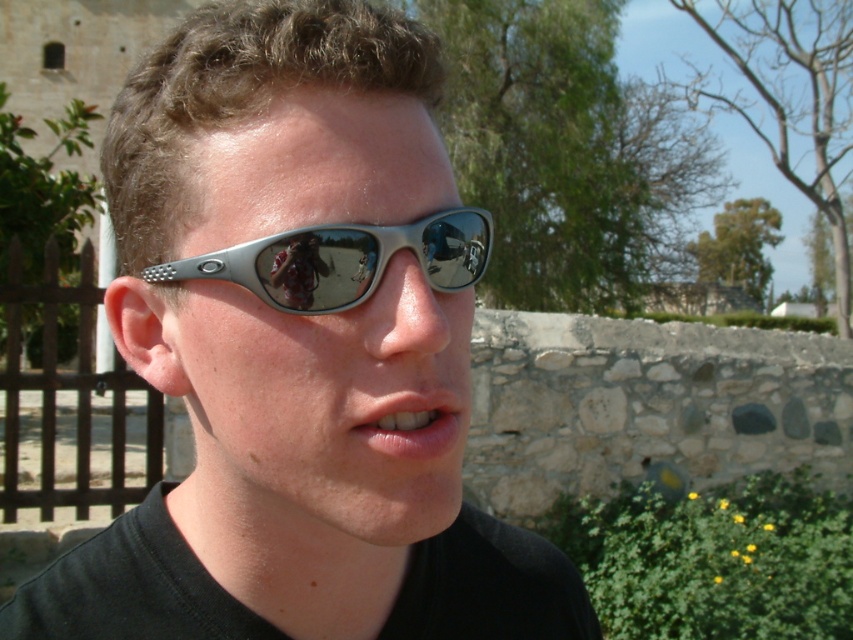
You are standing in front of a person wearing reflective sunglasses with a metallic frame. You want to place a small flower pot exactly at the point marked as point [440,486] in the image. If the flower pot has a diameter of 6 inches, will it fit comfortably without overlapping other objects?

The point [440,486] is 24.96 inches away from the viewer. Since the flower pot has a diameter of 6 inches, there is sufficient space for it to be placed comfortably at that location without overlapping other objects.

You are standing in front of the stone wall in the background of the image. You notice two points marked in the scene. The first point is at coordinates point [323,381] and the second point is at point [422,438]. Which of these points is closer to you?

Point [422,438] is closer to you because point [323,381] is behind it.

You are trying to choose between two pairs of sunglasses in the image. The first is the metallic silver sunglasses at center, and the second is the silver metallic sunglasses at center. Which pair has a greater width?

The metallic silver sunglasses at center has a greater width than the silver metallic sunglasses at center according to the description.